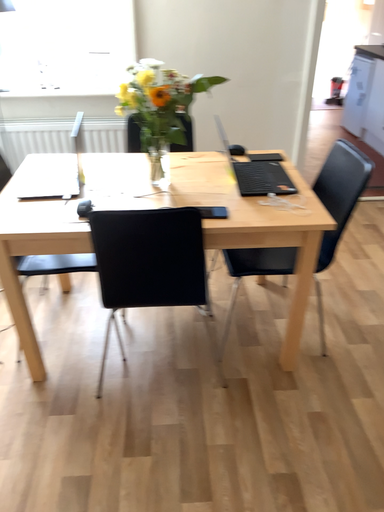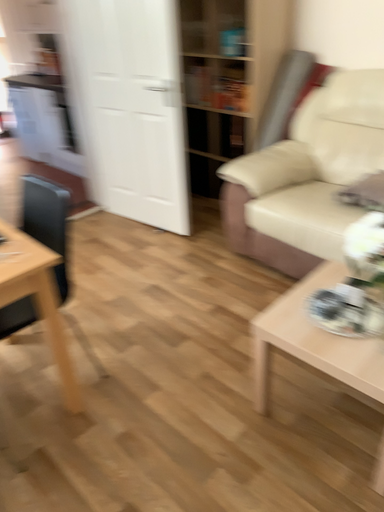
Question: How did the camera likely rotate when shooting the video?

Choices:
 (A) rotated right
 (B) rotated left

Answer: (A)